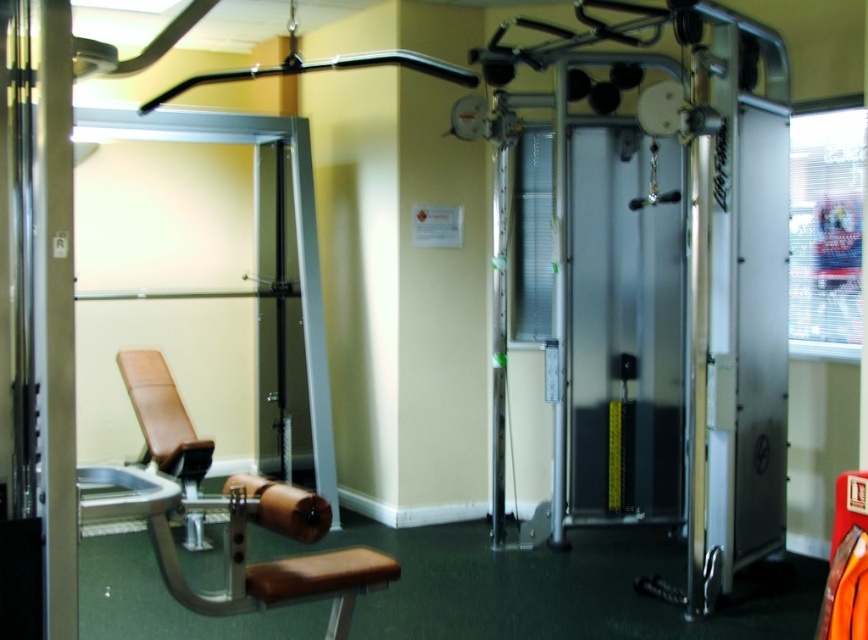
Question: Is brown leather bench at lower left further to the viewer compared to brown leather bench at lower center?

Choices:
 (A) no
 (B) yes

Answer: (B)

Question: Can you confirm if brown leather bench at lower left is positioned to the right of brown leather bench at lower center?

Choices:
 (A) no
 (B) yes

Answer: (A)

Question: Which point is farther to the camera?

Choices:
 (A) brown leather bench at lower left
 (B) brown leather bench at lower center

Answer: (A)

Question: Does brown leather bench at lower left have a larger size compared to brown leather bench at lower center?

Choices:
 (A) no
 (B) yes

Answer: (B)

Question: Among these objects, which one is farthest from the camera?

Choices:
 (A) brown leather bench at lower center
 (B) brown leather bench at lower left

Answer: (B)